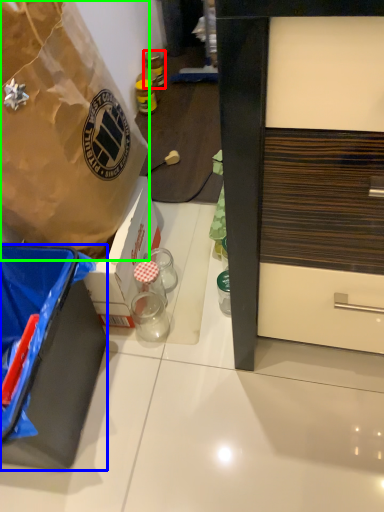
Question: Which is nearer to the bottle (highlighted by a red box)? box (highlighted by a blue box) or box (highlighted by a green box).

Choices:
 (A) box
 (B) box

Answer: (B)